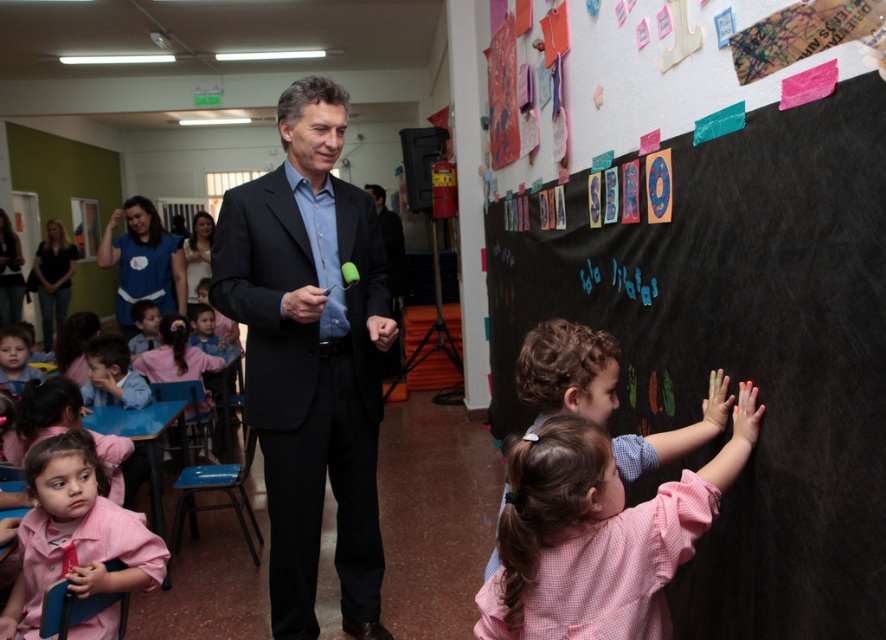
Which is more to the right, pink checkered shirt at lower left or blue fabric shirt at upper left?

From the viewer's perspective, pink checkered shirt at lower left appears more on the right side.

Can you confirm if pink checkered shirt at lower left is bigger than blue fabric shirt at upper left?

Incorrect, pink checkered shirt at lower left is not larger than blue fabric shirt at upper left.

Between point (48, 524) and point (148, 282), which one is positioned behind?

The point (148, 282) is more distant.

This screenshot has width=886, height=640. In order to click on pink checkered shirt at lower left in this screenshot , I will do `click(75, 532)`.

Which is above, matte black suit at center or pink checkered shirt at lower left?

matte black suit at center is above.

Can you confirm if matte black suit at center is smaller than pink checkered shirt at lower left?

No.

Where is `matte black suit at center`? This screenshot has width=886, height=640. matte black suit at center is located at coordinates (311, 356).

Can you confirm if black chalkboard at center is taller than blue fabric shirt at upper left?

Correct, black chalkboard at center is much taller as blue fabric shirt at upper left.

This screenshot has width=886, height=640. What do you see at coordinates (742, 349) in the screenshot?
I see `black chalkboard at center` at bounding box center [742, 349].

Who is more forward, [584,262] or [166,253]?

Point [584,262] is in front.

Locate an element on the screen. The image size is (886, 640). black chalkboard at center is located at coordinates (742, 349).